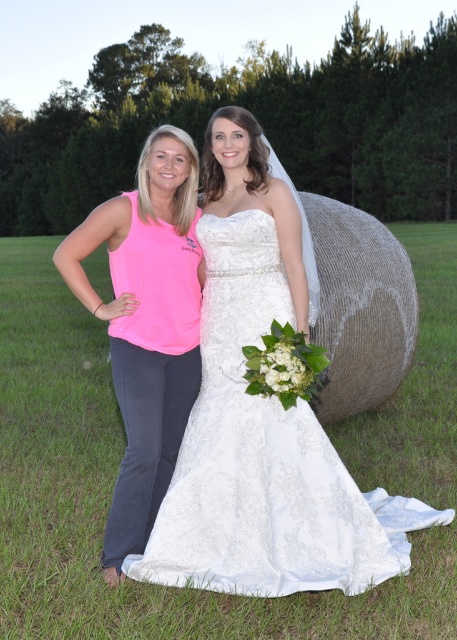
In the scene shown: You are a photographer trying to capture a photo of both the woman in the bright pink sleeveless top and dark gray pants and the woman in the elegant white wedding gown with a long train. You notice two points marked on your camera screen at coordinates point [265,282] and point [101,305]. Based on their positions, which point is located behind the other?

Point [265,282] is behind point [101,305].

You are a photographer setting up for a group photo. You need to position the white lace dress at center and the pink fabric tank top at left so that there is at least 50 centimeters between them for proper framing. Based on the current distance, is the spacing sufficient?

The white lace dress at center is currently 47.54 centimeters from the pink fabric tank top at left, which is less than the required 50 centimeters. Therefore, the spacing is insufficient and needs to be increased to meet the framing requirement.

You are a photographer setting up for a photoshoot in a grassy field. You need to ensure that the white lace dress at center and the pink fabric tank top at left are both visible in the frame. Based on their positions, which clothing item is closer to the camera?

The white lace dress at center is positioned under the pink fabric tank top at left, meaning it is closer to the camera since it appears below the other item in the frame.